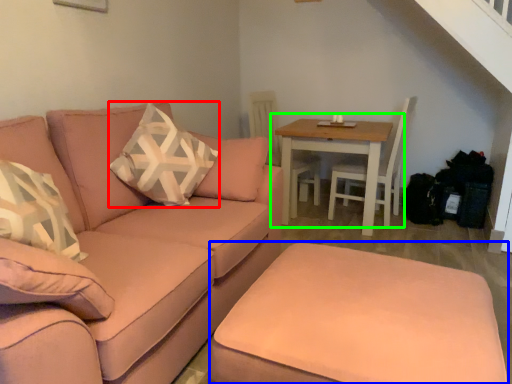
Question: Based on their relative distances, which object is farther from throw pillow (highlighted by a red box)? Choose from footrest (highlighted by a blue box) and table (highlighted by a green box).

Choices:
 (A) footrest
 (B) table

Answer: (B)